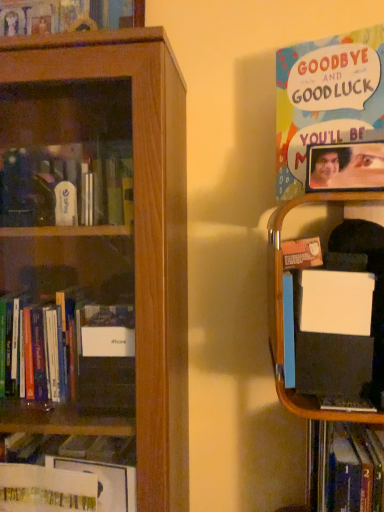
Question: Considering the relative sizes of wooden picture frame at upper right and wooden bookcase at left in the image provided, is wooden picture frame at upper right shorter than wooden bookcase at left?

Choices:
 (A) yes
 (B) no

Answer: (A)

Question: Is wooden bookcase at left at the back of wooden picture frame at upper right?

Choices:
 (A) yes
 (B) no

Answer: (B)

Question: Is wooden picture frame at upper right positioned behind wooden bookcase at left?

Choices:
 (A) no
 (B) yes

Answer: (B)

Question: Is wooden picture frame at upper right surrounding wooden bookcase at left?

Choices:
 (A) yes
 (B) no

Answer: (B)

Question: Is wooden picture frame at upper right beside wooden bookcase at left?

Choices:
 (A) no
 (B) yes

Answer: (A)

Question: Considering the positions of point (304, 133) and point (339, 500), is point (304, 133) closer or farther from the camera than point (339, 500)?

Choices:
 (A) farther
 (B) closer

Answer: (A)

Question: Is multicolored paper poster at upper right, the second book when ordered from bottom to top, in front of or behind hardcover book at lower right, the first book when ordered from bottom to top, in the image?

Choices:
 (A) behind
 (B) front

Answer: (A)

Question: In terms of width, does multicolored paper poster at upper right, the second book when ordered from bottom to top, look wider or thinner when compared to hardcover book at lower right, the first book when ordered from bottom to top?

Choices:
 (A) wide
 (B) thin

Answer: (B)

Question: From the image's perspective, relative to hardcover book at lower right, marked as the second book in a top-to-bottom arrangement, is multicolored paper poster at upper right, positioned as the first book in top-to-bottom order, above or below?

Choices:
 (A) below
 (B) above

Answer: (B)

Question: Considering the positions of wooden picture frame at upper right and hardcover book at lower right, marked as the second book in a top-to-bottom arrangement, in the image, is wooden picture frame at upper right bigger or smaller than hardcover book at lower right, marked as the second book in a top-to-bottom arrangement,?

Choices:
 (A) big
 (B) small

Answer: (B)

Question: Is point (352, 160) positioned closer to the camera than point (311, 439)?

Choices:
 (A) closer
 (B) farther

Answer: (A)

Question: Considering the positions of wooden picture frame at upper right and hardcover book at lower right, the first book when ordered from bottom to top, in the image, is wooden picture frame at upper right taller or shorter than hardcover book at lower right, the first book when ordered from bottom to top,?

Choices:
 (A) short
 (B) tall

Answer: (A)

Question: From the image's perspective, is wooden picture frame at upper right positioned above or below hardcover book at lower right, marked as the second book in a top-to-bottom arrangement?

Choices:
 (A) below
 (B) above

Answer: (B)

Question: From a real-world perspective, relative to multicolored paper poster at upper right, the second book when ordered from bottom to top, is hardcover book at lower right, the first book when ordered from bottom to top, vertically above or below?

Choices:
 (A) below
 (B) above

Answer: (A)

Question: In the image, is hardcover book at lower right, marked as the second book in a top-to-bottom arrangement, on the left side or the right side of multicolored paper poster at upper right, positioned as the first book in top-to-bottom order?

Choices:
 (A) left
 (B) right

Answer: (B)